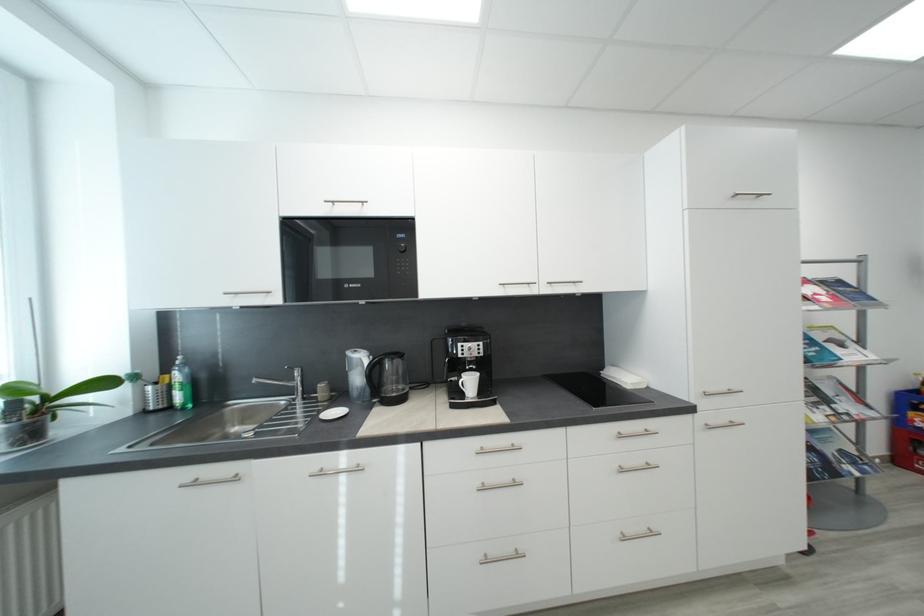
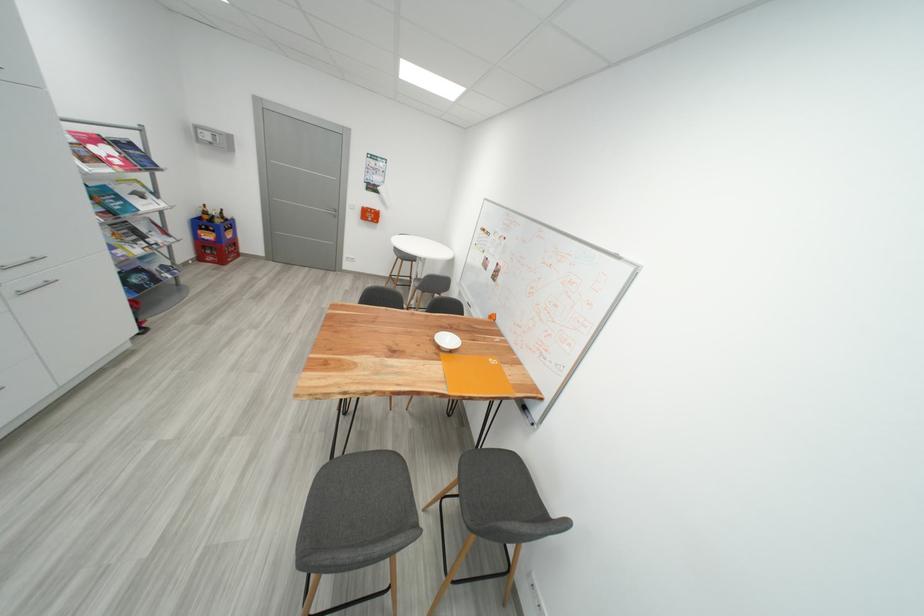
Find the pixel in the second image that matches point (731, 391) in the first image.

(32, 260)